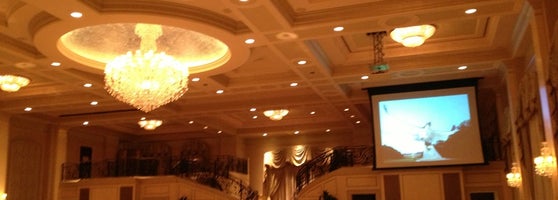
At what (x,y) coordinates should I click in order to perform the action: click on wall. Please return your answer as a coordinate pair (x, y). The width and height of the screenshot is (558, 200). Looking at the image, I should click on (157, 192).